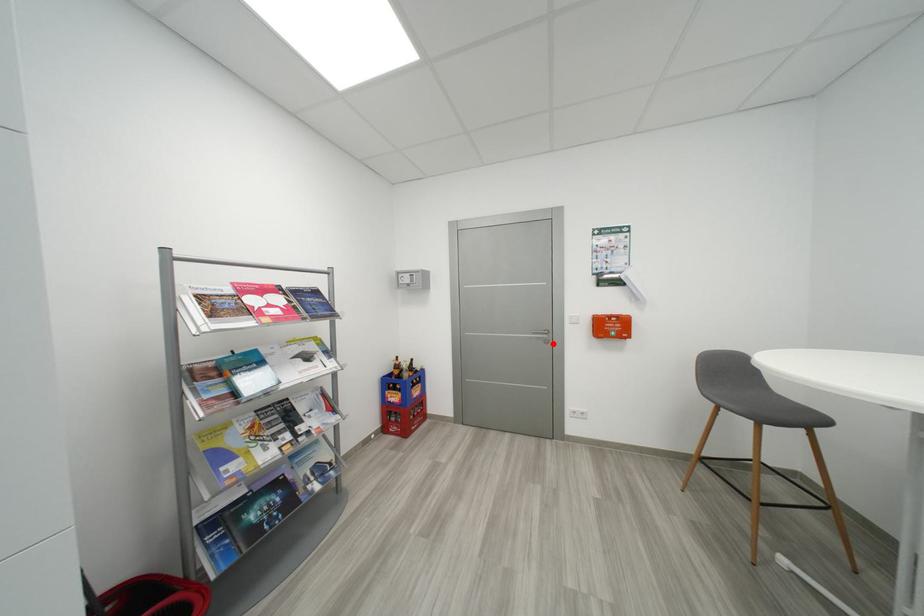
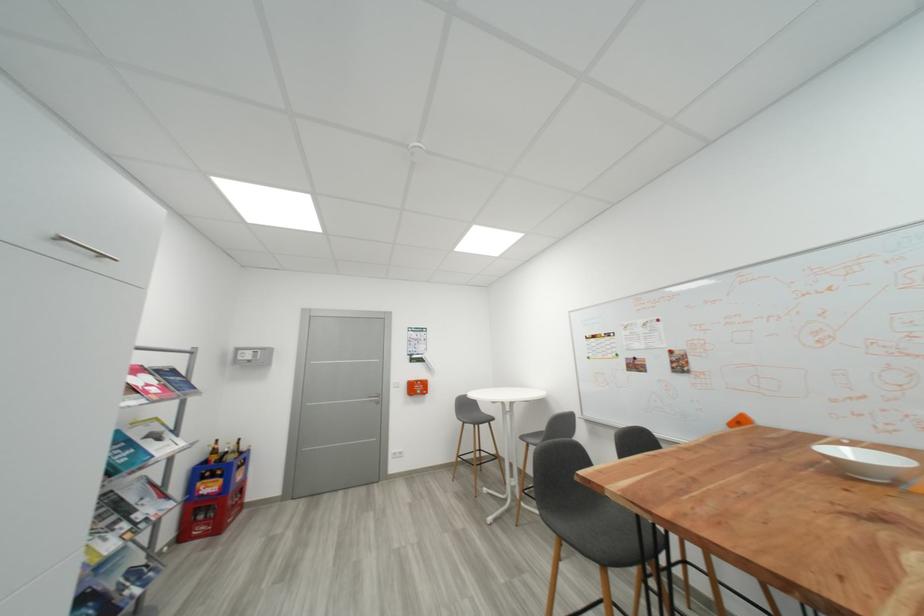
Question: I am providing you with two images of the same scene from different viewpoints. A red point is shown in image1. For the corresponding object point in image2, is it positioned nearer or farther from the camera?

Choices:
 (A) Nearer
 (B) Farther

Answer: (B)